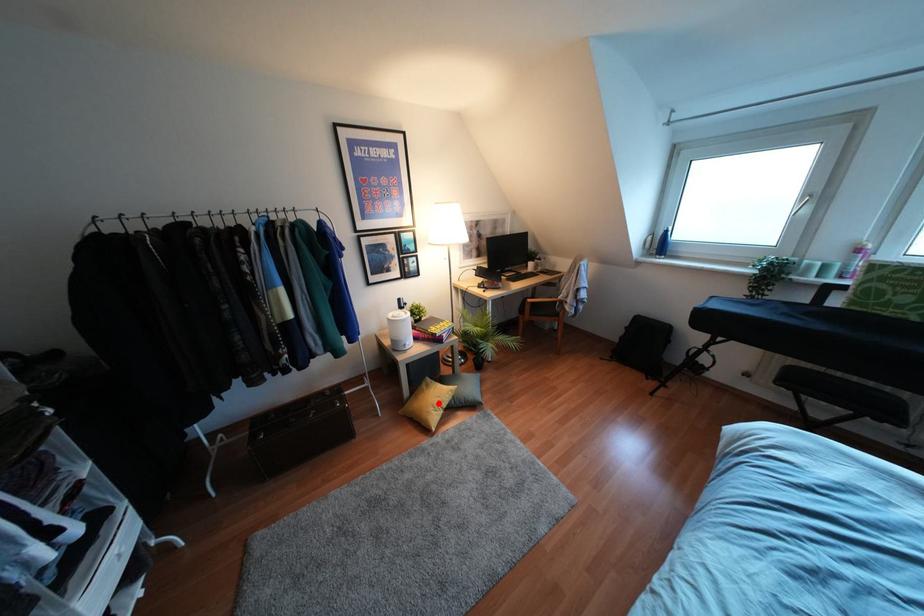
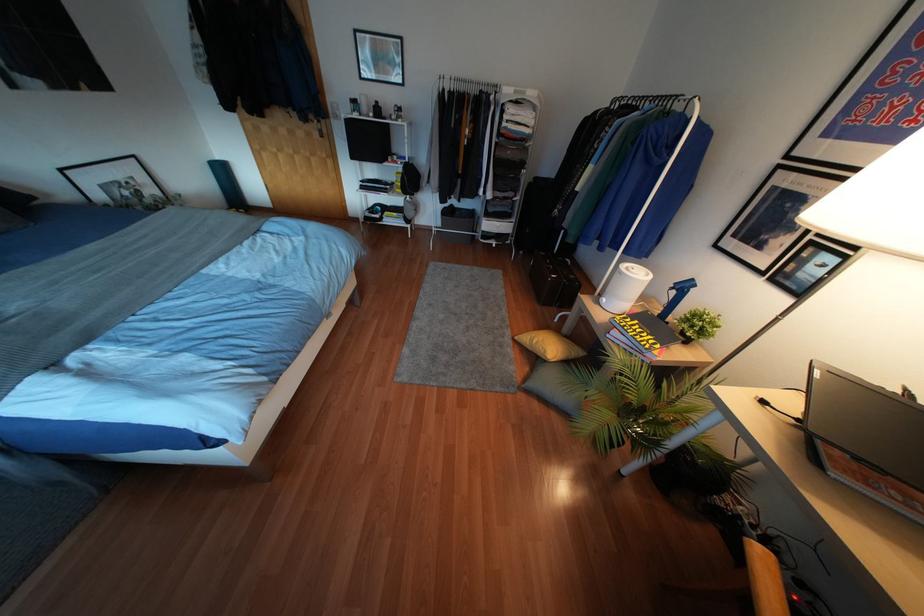
The point at the highlighted location is marked in the first image. Where is the corresponding point in the second image?

(533, 341)